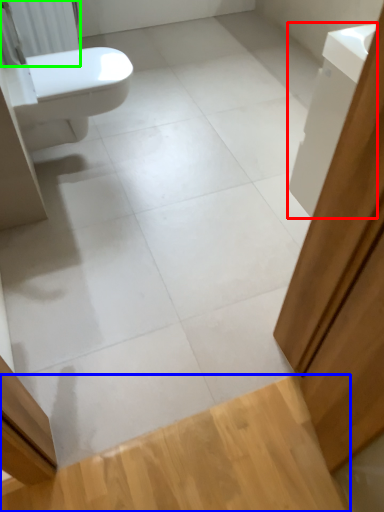
Question: Which is nearer to the cabinetry (highlighted by a red box)? plank (highlighted by a blue box) or radiator (highlighted by a green box).

Choices:
 (A) plank
 (B) radiator

Answer: (A)